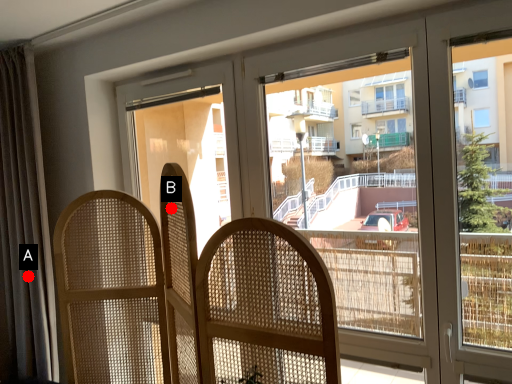
Question: Two points are circled on the image, labeled by A and B beside each circle. Which of the following is the closest to the observer?

Choices:
 (A) A is closer
 (B) B is closer

Answer: (B)